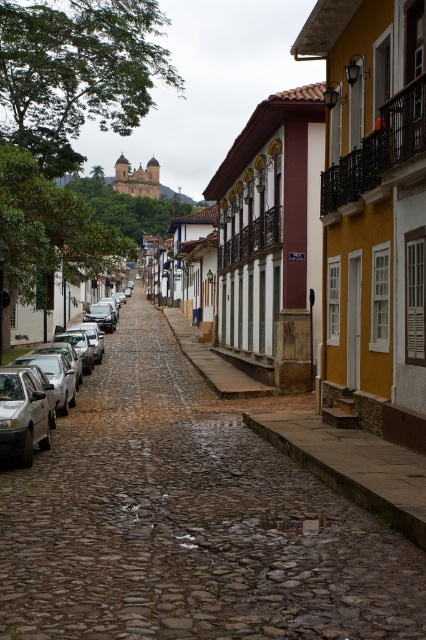
Describe the element at coordinates (189, 520) in the screenshot. This screenshot has width=426, height=640. I see `cobblestone alley at center` at that location.

In the scene shown: Which is below, cobblestone alley at center or yellow painted wall at right?

cobblestone alley at center is lower down.

Locate an element on the screen. The width and height of the screenshot is (426, 640). cobblestone alley at center is located at coordinates point(189,520).

The height and width of the screenshot is (640, 426). What do you see at coordinates (189, 520) in the screenshot?
I see `cobblestone alley at center` at bounding box center [189, 520].

Which is in front, point (330, 600) or point (31, 432)?

Point (330, 600) is more forward.

Where is `cobblestone alley at center`? The height and width of the screenshot is (640, 426). cobblestone alley at center is located at coordinates (189, 520).

Is the position of yellow painted wall at right less distant than that of silver metallic car at left?

That is True.

Describe the element at coordinates (373, 212) in the screenshot. This screenshot has height=640, width=426. I see `yellow painted wall at right` at that location.

Find the location of a particular element. Image resolution: width=426 pixels, height=640 pixels. yellow painted wall at right is located at coordinates (373, 212).